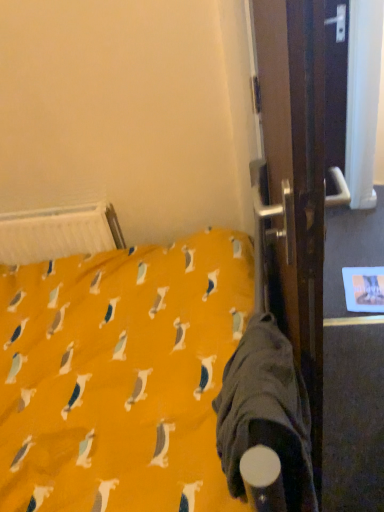
At what (x,y) coordinates should I click in order to perform the action: click on white plastic radiator at upper left. Please return your answer as a coordinate pair (x, y). Looking at the image, I should click on (58, 233).

The height and width of the screenshot is (512, 384). What do you see at coordinates (58, 233) in the screenshot? I see `white plastic radiator at upper left` at bounding box center [58, 233].

What do you see at coordinates (266, 412) in the screenshot? This screenshot has height=512, width=384. I see `dark gray fabric sleeping bag at lower right` at bounding box center [266, 412].

Locate an element on the screen. This screenshot has height=512, width=384. dark gray fabric sleeping bag at lower right is located at coordinates coord(266,412).

You are a GUI agent. You are given a task and a screenshot of the screen. Output one action in this format:
    pyautogui.click(x=<x>, y=<y>)
    Task: Click on the white plastic radiator at upper left
    
    Given the screenshot: What is the action you would take?
    pyautogui.click(x=58, y=233)

Which is more to the left, dark gray fabric sleeping bag at lower right or white plastic radiator at upper left?

Positioned to the left is white plastic radiator at upper left.

Considering the positions of objects dark gray fabric sleeping bag at lower right and white plastic radiator at upper left in the image provided, who is behind, dark gray fabric sleeping bag at lower right or white plastic radiator at upper left?

white plastic radiator at upper left.

Is point (225, 466) closer or farther from the camera than point (58, 238)?

Clearly, point (225, 466) is closer to the camera than point (58, 238).

From the image's perspective, which is below, dark gray fabric sleeping bag at lower right or white plastic radiator at upper left?

dark gray fabric sleeping bag at lower right appears lower in the image.

From a real-world perspective, which object rests below the other?

Answer: white plastic radiator at upper left, from a real-world perspective.

Which object is thinner, dark gray fabric sleeping bag at lower right or white plastic radiator at upper left?

With smaller width is white plastic radiator at upper left.

Is dark gray fabric sleeping bag at lower right shorter than white plastic radiator at upper left?

Incorrect, the height of dark gray fabric sleeping bag at lower right does not fall short of that of white plastic radiator at upper left.

Can you confirm if dark gray fabric sleeping bag at lower right is smaller than white plastic radiator at upper left?

Actually, dark gray fabric sleeping bag at lower right might be larger than white plastic radiator at upper left.

Is dark gray fabric sleeping bag at lower right not inside white plastic radiator at upper left?

Indeed, dark gray fabric sleeping bag at lower right is completely outside white plastic radiator at upper left.

Is dark gray fabric sleeping bag at lower right next to white plastic radiator at upper left and touching it?

They are not placed beside each other.

Is dark gray fabric sleeping bag at lower right turned away from white plastic radiator at upper left?

No, dark gray fabric sleeping bag at lower right is not facing the opposite direction of white plastic radiator at upper left.

You are a GUI agent. You are given a task and a screenshot of the screen. Output one action in this format:
    pyautogui.click(x=<x>, y=<y>)
    Task: Click on the radiator that is on the left side of dark gray fabric sleeping bag at lower right
    The width and height of the screenshot is (384, 512).
    Given the screenshot: What is the action you would take?
    pyautogui.click(x=58, y=233)

Considering the positions of objects white plastic radiator at upper left and dark gray fabric sleeping bag at lower right in the image provided, who is more to the left, white plastic radiator at upper left or dark gray fabric sleeping bag at lower right?

From the viewer's perspective, white plastic radiator at upper left appears more on the left side.

Is white plastic radiator at upper left in front of dark gray fabric sleeping bag at lower right?

No, white plastic radiator at upper left is further to the viewer.

Does point (27, 244) come in front of point (289, 505)?

No, (27, 244) is behind (289, 505).

From the image's perspective, is white plastic radiator at upper left located above or below dark gray fabric sleeping bag at lower right?

From the image's perspective, white plastic radiator at upper left appears above dark gray fabric sleeping bag at lower right.

From a real-world perspective, relative to dark gray fabric sleeping bag at lower right, is white plastic radiator at upper left vertically above or below?

From a real-world perspective, white plastic radiator at upper left is physically below dark gray fabric sleeping bag at lower right.

Which object is thinner, white plastic radiator at upper left or dark gray fabric sleeping bag at lower right?

Thinner between the two is white plastic radiator at upper left.

Can you confirm if white plastic radiator at upper left is taller than dark gray fabric sleeping bag at lower right?

No, white plastic radiator at upper left is not taller than dark gray fabric sleeping bag at lower right.

Does white plastic radiator at upper left have a larger size compared to dark gray fabric sleeping bag at lower right?

Incorrect, white plastic radiator at upper left is not larger than dark gray fabric sleeping bag at lower right.

Looking at this image, would you say dark gray fabric sleeping bag at lower right is part of white plastic radiator at upper left's contents?

Definitely not — dark gray fabric sleeping bag at lower right is not inside white plastic radiator at upper left.

Is white plastic radiator at upper left not close to dark gray fabric sleeping bag at lower right?

white plastic radiator at upper left is actually quite close to dark gray fabric sleeping bag at lower right.

Is white plastic radiator at upper left positioned with its back to dark gray fabric sleeping bag at lower right?

No, white plastic radiator at upper left is not facing away from dark gray fabric sleeping bag at lower right.

How different are the orientations of white plastic radiator at upper left and dark gray fabric sleeping bag at lower right in degrees?

There is a 93.2-degree angle between the facing directions of white plastic radiator at upper left and dark gray fabric sleeping bag at lower right.

The height and width of the screenshot is (512, 384). I want to click on sleeping bag below the white plastic radiator at upper left (from the image's perspective), so click(266, 412).

This screenshot has height=512, width=384. Identify the location of sleeping bag above the white plastic radiator at upper left (from a real-world perspective). coord(266,412).

Where is `radiator to the left of dark gray fabric sleeping bag at lower right`? This screenshot has width=384, height=512. radiator to the left of dark gray fabric sleeping bag at lower right is located at coordinates (58, 233).